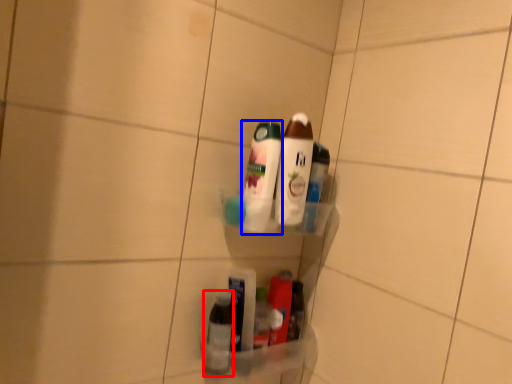
Question: Which object appears closest to the camera in this image, bottle (highlighted by a red box) or bottle (highlighted by a blue box)?

Choices:
 (A) bottle
 (B) bottle

Answer: (B)